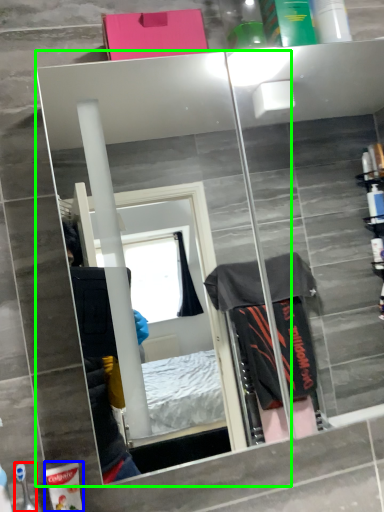
Question: Considering the real-world distances, which object is closest to toiletry (highlighted by a red box)? toiletry (highlighted by a blue box) or mirror (highlighted by a green box).

Choices:
 (A) toiletry
 (B) mirror

Answer: (A)